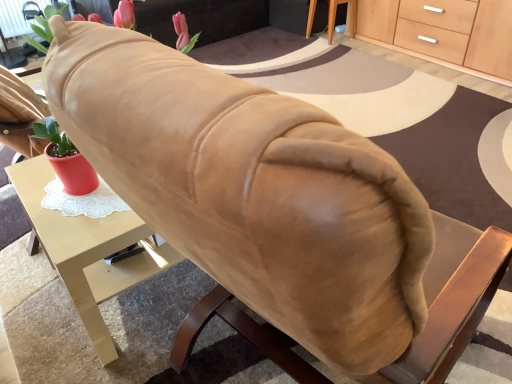
Where is `free space below matte gold desk at center (from a real-world perspective)`? The height and width of the screenshot is (384, 512). free space below matte gold desk at center (from a real-world perspective) is located at coordinates (147, 297).